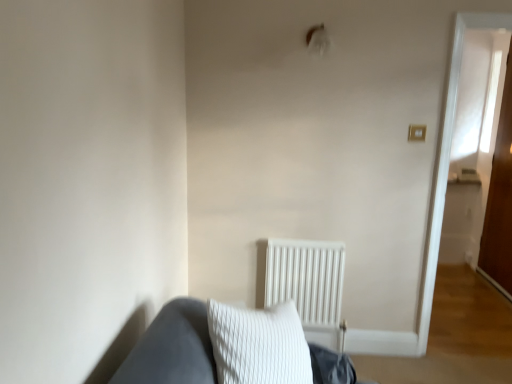
You are a GUI agent. You are given a task and a screenshot of the screen. Output one action in this format:
    pyautogui.click(x=<x>, y=<y>)
    Task: Click on the white matte radiator at center
    The height and width of the screenshot is (384, 512).
    Given the screenshot: What is the action you would take?
    pyautogui.click(x=306, y=279)

What do you see at coordinates (306, 279) in the screenshot? I see `white matte radiator at center` at bounding box center [306, 279].

The image size is (512, 384). I want to click on transparent glass door at right, so click(x=500, y=200).

The width and height of the screenshot is (512, 384). Describe the element at coordinates (500, 200) in the screenshot. I see `transparent glass door at right` at that location.

Image resolution: width=512 pixels, height=384 pixels. I want to click on white matte radiator at center, so click(x=306, y=279).

Between transparent glass door at right and white matte radiator at center, which one appears on the right side from the viewer's perspective?

transparent glass door at right is more to the right.

Does transparent glass door at right lie behind white matte radiator at center?

Yes.

Considering the points (493, 224) and (266, 290), which point is behind, point (493, 224) or point (266, 290)?

Positioned behind is point (493, 224).

From the image's perspective, which one is positioned higher, transparent glass door at right or white matte radiator at center?

From the image's view, transparent glass door at right is above.

From a real-world perspective, between transparent glass door at right and white matte radiator at center, who is vertically lower?

In real-world perspective, white matte radiator at center is lower.

Can you confirm if transparent glass door at right is thinner than white matte radiator at center?

Correct, the width of transparent glass door at right is less than that of white matte radiator at center.

Which of these two, transparent glass door at right or white matte radiator at center, stands taller?

transparent glass door at right is taller.

In terms of size, does transparent glass door at right appear bigger or smaller than white matte radiator at center?

Considering their sizes, transparent glass door at right takes up more space than white matte radiator at center.

Is transparent glass door at right spatially inside white matte radiator at center, or outside of it?

transparent glass door at right is spatially situated outside white matte radiator at center.

Are transparent glass door at right and white matte radiator at center making contact?

transparent glass door at right is not next to white matte radiator at center, and they're not touching.

Does transparent glass door at right turn towards white matte radiator at center?

No.

What's the angular difference between transparent glass door at right and white matte radiator at center's facing directions?

The angle between the facing direction of transparent glass door at right and the facing direction of white matte radiator at center is 89.3 degrees.

Identify the location of radiator below the transparent glass door at right (from the image's perspective). The height and width of the screenshot is (384, 512). (306, 279).

Does white matte radiator at center appear on the right side of transparent glass door at right?

In fact, white matte radiator at center is to the left of transparent glass door at right.

Is white matte radiator at center positioned behind transparent glass door at right?

No.

Does point (304, 246) lie in front of point (486, 268)?

Yes, it is in front of point (486, 268).

From the image's perspective, is white matte radiator at center below transparent glass door at right?

Yes.

From a real-world perspective, is white matte radiator at center beneath transparent glass door at right?

Yes, from a real-world perspective, white matte radiator at center is under transparent glass door at right.

Which of these two, white matte radiator at center or transparent glass door at right, is wider?

Wider between the two is white matte radiator at center.

In terms of height, does white matte radiator at center look taller or shorter compared to transparent glass door at right?

Considering their sizes, white matte radiator at center has less height than transparent glass door at right.

Between white matte radiator at center and transparent glass door at right, which one has smaller size?

Smaller between the two is white matte radiator at center.

Can transparent glass door at right be found inside white matte radiator at center?

That's incorrect, transparent glass door at right is not inside white matte radiator at center.

Would you say white matte radiator at center is a long distance from transparent glass door at right?

white matte radiator at center is positioned a significant distance from transparent glass door at right.

Is white matte radiator at center facing towards transparent glass door at right?

No, white matte radiator at center is not aimed at transparent glass door at right.

Locate an element on the screen. glass door behind the white matte radiator at center is located at coordinates (500, 200).

Identify the location of glass door located above the white matte radiator at center (from the image's perspective). (500, 200).

The image size is (512, 384). Find the location of `radiator on the left of the transparent glass door at right`. radiator on the left of the transparent glass door at right is located at coordinates (306, 279).